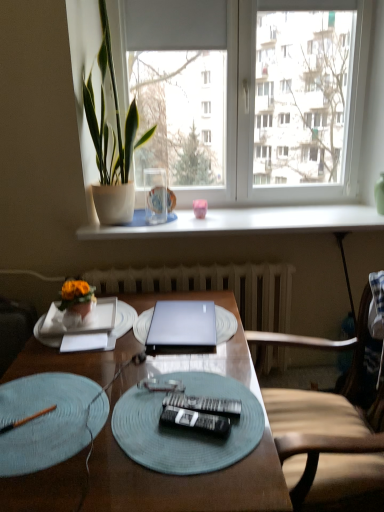
What are the coordinates of `empty space that is in between orange wood pen at lower left and white paper at center` in the screenshot? It's located at (60, 380).